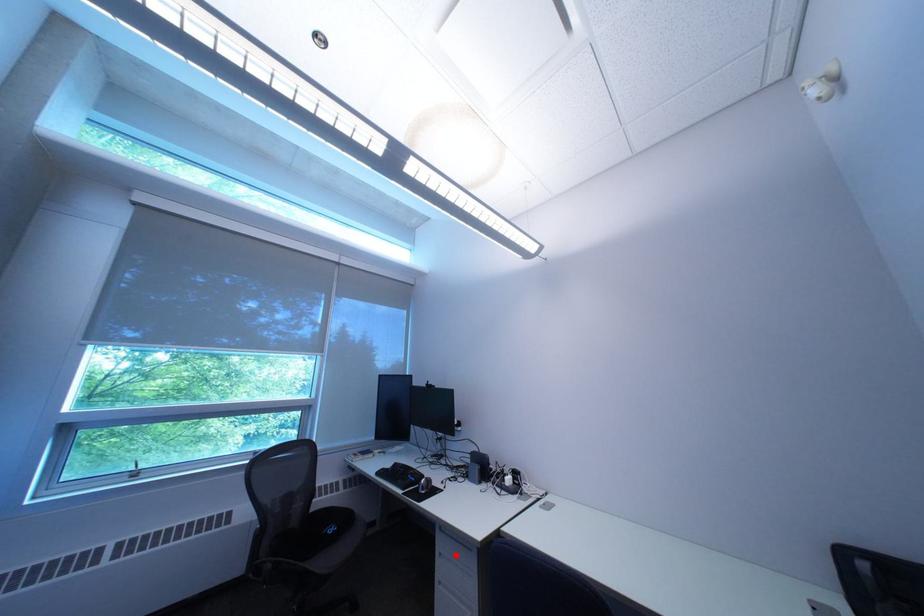
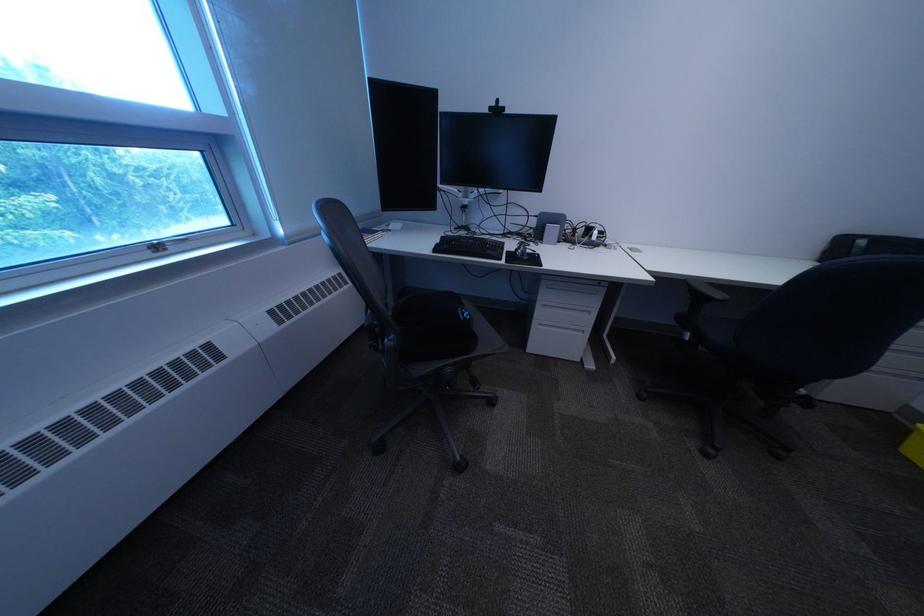
Question: I am providing you with two images of the same scene from different viewpoints. A red point is shown in image1. For the corresponding object point in image2, is it positioned nearer or farther from the camera?

Choices:
 (A) Nearer
 (B) Farther

Answer: (A)